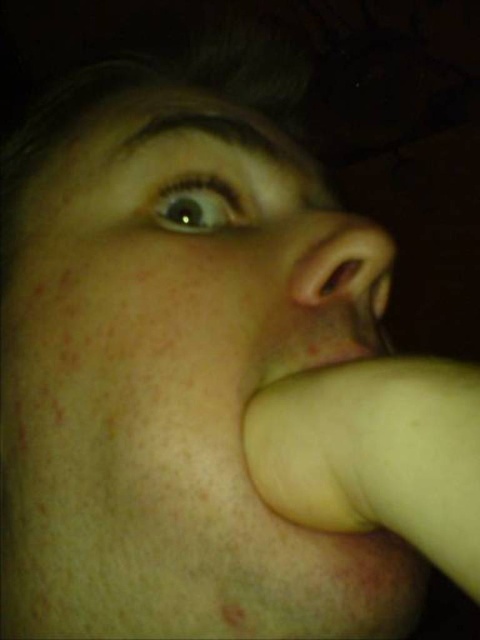
Is smooth skin nose at center to the left of smooth yellowish flesh at lower center from the viewer's perspective?

No, smooth skin nose at center is not to the left of smooth yellowish flesh at lower center.

Can you confirm if smooth skin nose at center is smaller than smooth yellowish flesh at lower center?

No.

Is point (354, 237) in front of point (339, 349)?

No.

Locate an element on the screen. The image size is (480, 640). smooth skin nose at center is located at coordinates (346, 266).

Is point (314, 488) more distant than point (337, 236)?

No, it is not.

What do you see at coordinates (375, 452) in the screenshot? The height and width of the screenshot is (640, 480). I see `smooth yellow hand at lower right` at bounding box center [375, 452].

Identify the location of smooth yellow hand at lower right. (375, 452).

Based on the photo, can you confirm if smooth yellow hand at lower right is positioned to the left of smooth yellowish flesh at lower center?

In fact, smooth yellow hand at lower right is to the right of smooth yellowish flesh at lower center.

Can you confirm if smooth yellow hand at lower right is smaller than smooth yellowish flesh at lower center?

Actually, smooth yellow hand at lower right might be larger than smooth yellowish flesh at lower center.

Does point (408, 474) come farther from viewer compared to point (343, 336)?

That is False.

You are a GUI agent. You are given a task and a screenshot of the screen. Output one action in this format:
    pyautogui.click(x=<x>, y=<y>)
    Task: Click on the smooth yellow hand at lower right
    This screenshot has width=480, height=640.
    Given the screenshot: What is the action you would take?
    pyautogui.click(x=375, y=452)